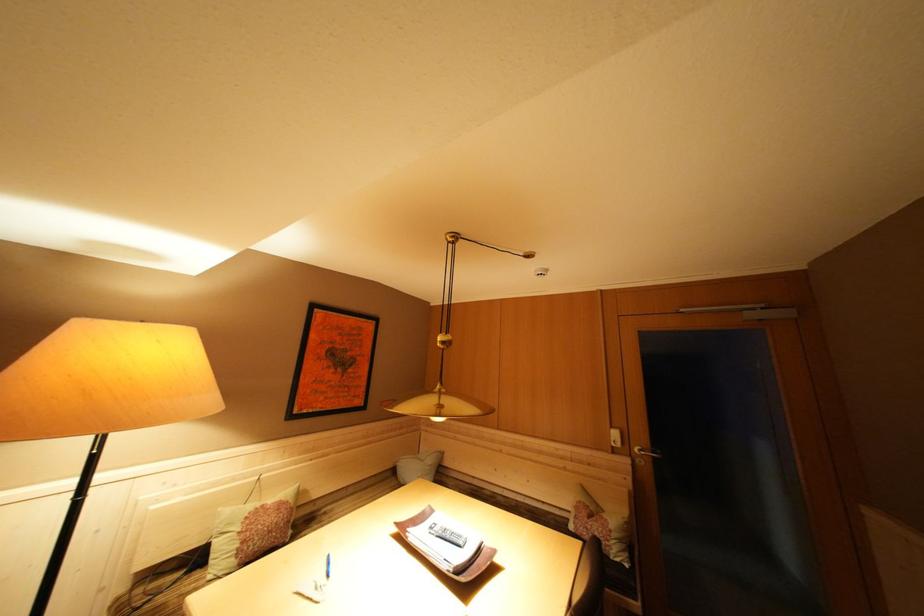
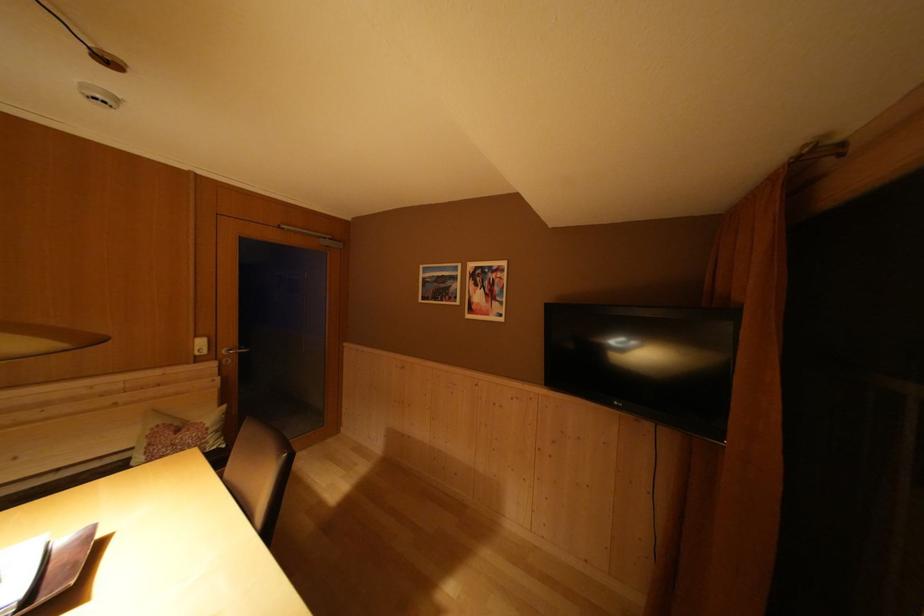
Question: The camera is either moving clockwise (left) or counter-clockwise (right) around the object. The first image is from the beginning of the video and the second image is from the end. Is the camera moving left or right when shooting the video?

Choices:
 (A) Left
 (B) Right

Answer: (A)